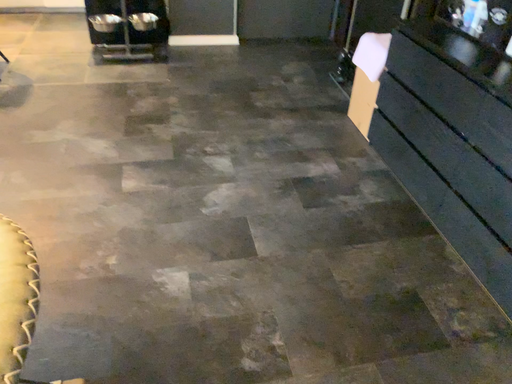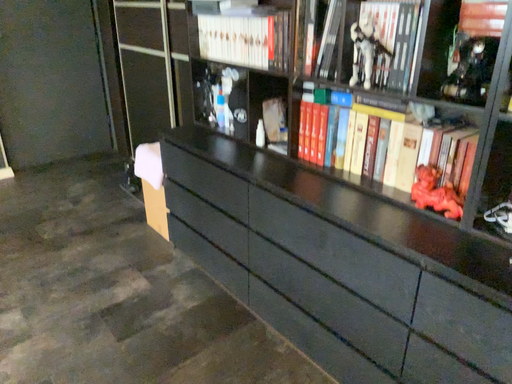
Question: Which way did the camera rotate in the video?

Choices:
 (A) rotated upward
 (B) rotated downward

Answer: (A)